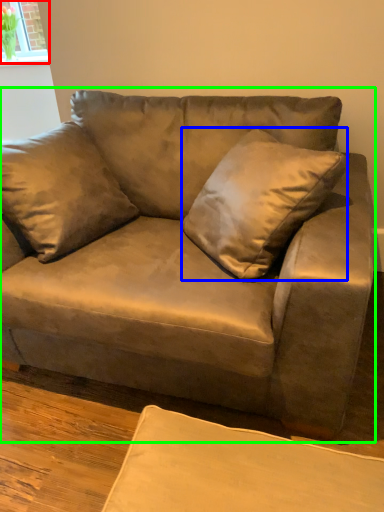
Question: Which object is positioned closest to window (highlighted by a red box)? Select from throw pillow (highlighted by a blue box) and studio couch (highlighted by a green box).

Choices:
 (A) throw pillow
 (B) studio couch

Answer: (B)